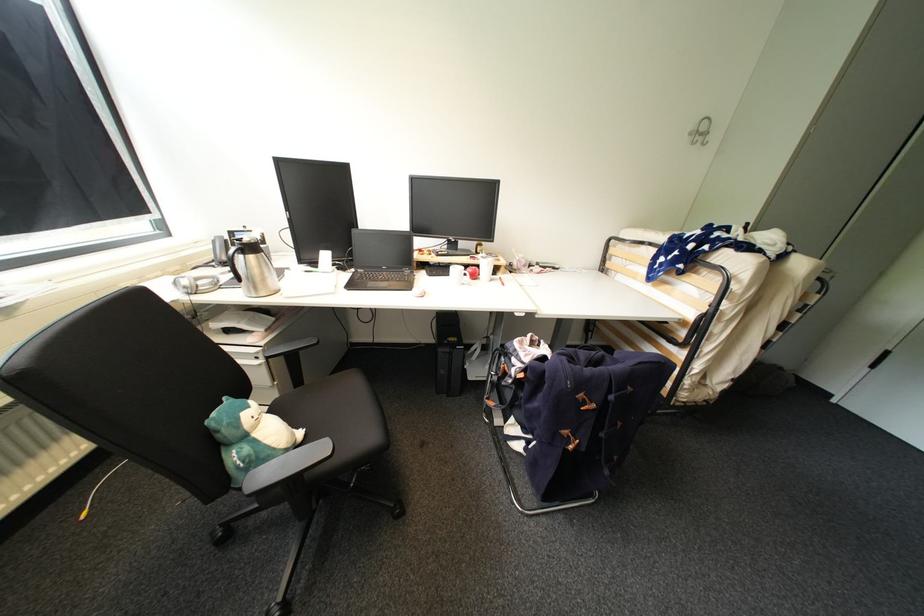
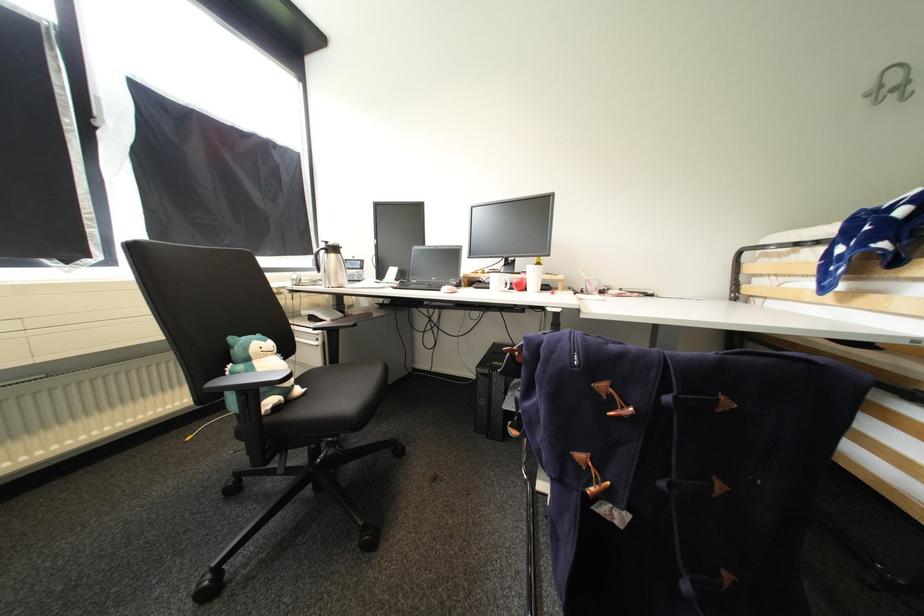
The point at (494,265) is marked in the first image. Where is the corresponding point in the second image?

(541, 273)